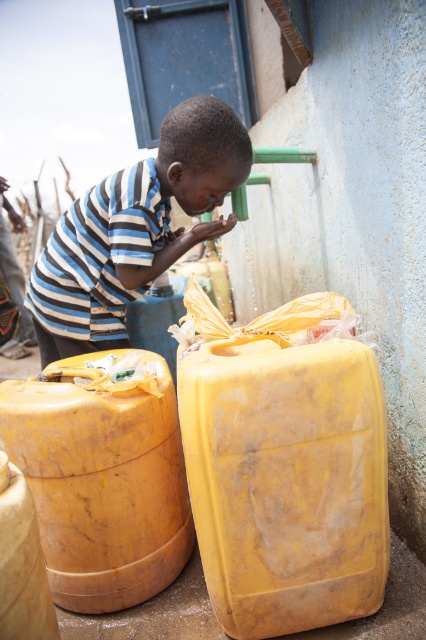
Question: Which object is the closest to the yellow matte barrel at right?

Choices:
 (A) matte yellow barrel at lower left
 (B) striped fabric boy at center

Answer: (A)

Question: Considering the relative positions of yellow matte barrel at right and matte yellow barrel at lower left in the image provided, where is yellow matte barrel at right located with respect to matte yellow barrel at lower left?

Choices:
 (A) right
 (B) left

Answer: (A)

Question: Which object is farther from the camera taking this photo?

Choices:
 (A) striped fabric boy at center
 (B) yellow matte barrel at right

Answer: (A)

Question: Is yellow matte barrel at right smaller than striped fabric boy at center?

Choices:
 (A) no
 (B) yes

Answer: (B)

Question: Can you confirm if yellow matte barrel at right is positioned to the right of matte yellow barrel at lower left?

Choices:
 (A) no
 (B) yes

Answer: (B)

Question: Which point is farther from the camera taking this photo?

Choices:
 (A) (241, 465)
 (B) (213, 115)
 (C) (123, 490)

Answer: (B)